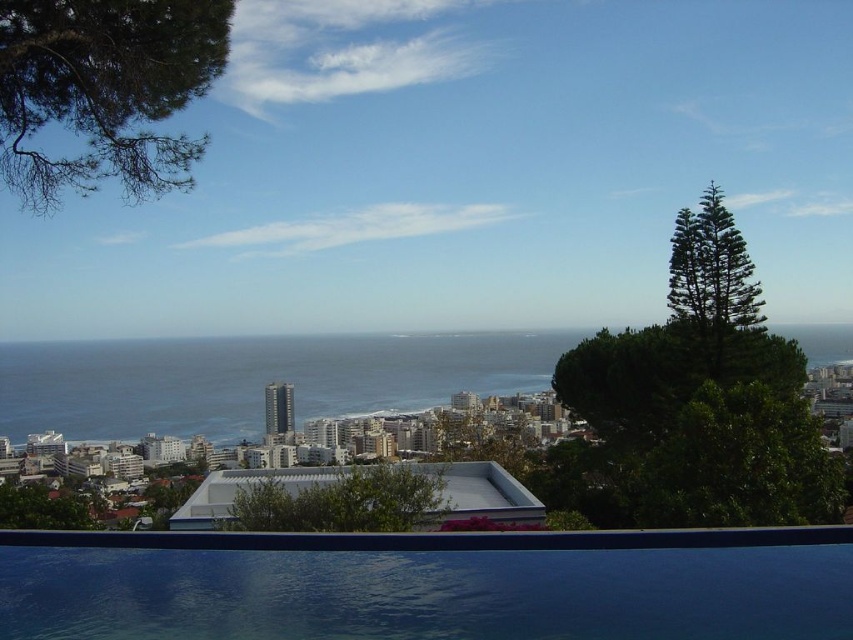
Is point (28, 632) positioned behind point (494, 344)?

No, it is in front of (494, 344).

This screenshot has width=853, height=640. What do you see at coordinates (434, 589) in the screenshot?
I see `dark blue smooth pool at lower center` at bounding box center [434, 589].

You are a GUI agent. You are given a task and a screenshot of the screen. Output one action in this format:
    pyautogui.click(x=<x>, y=<y>)
    Task: Click on the dark blue smooth pool at lower center
    
    Given the screenshot: What is the action you would take?
    pyautogui.click(x=434, y=589)